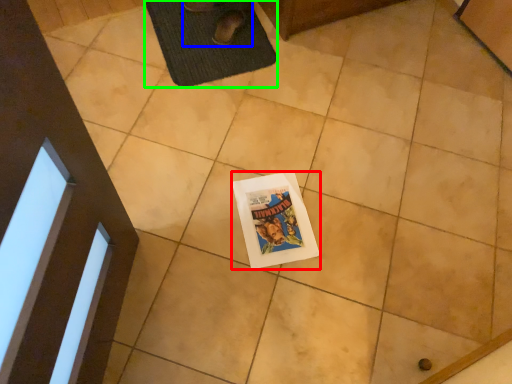
Question: Which object is the closest to the comic book (highlighted by a red box)? Choose among these: person (highlighted by a blue box) or bath mat (highlighted by a green box).

Choices:
 (A) person
 (B) bath mat

Answer: (B)